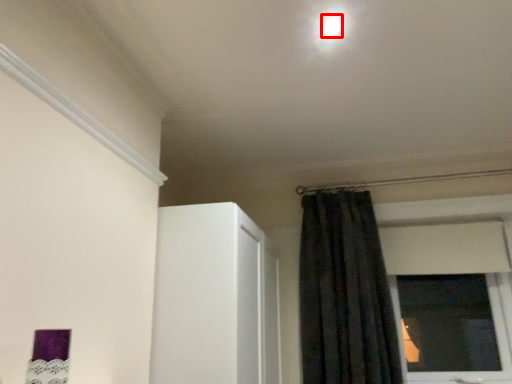
Question: From the image's perspective, where is light (annotated by the red box) located relative to curtain?

Choices:
 (A) below
 (B) above

Answer: (B)